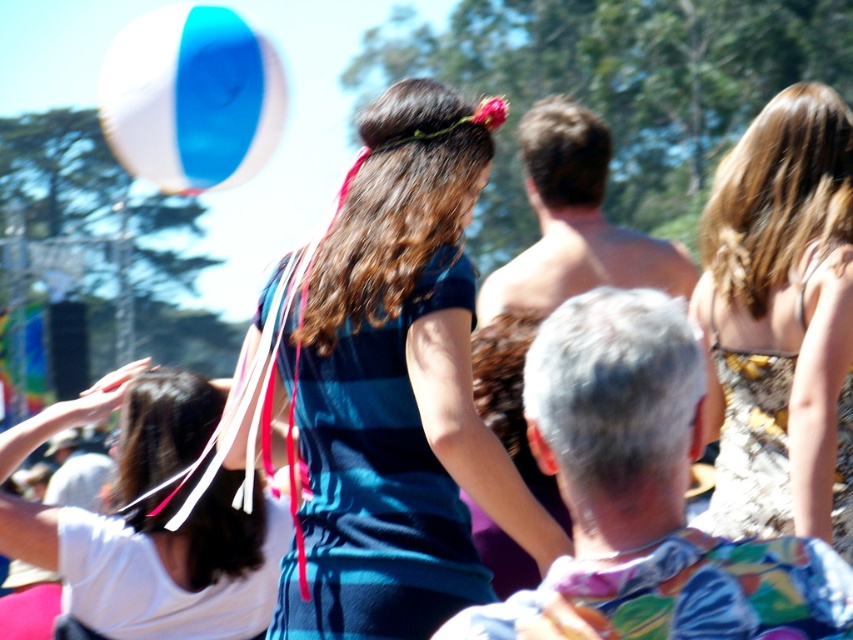
You are standing in the crowd at the festival and want to get a better view of the performance. You notice the brown textured dress at center and the white fabric headband at upper left. Which object is closer to you so you can decide where to move?

The brown textured dress at center is closer to the viewer than the white fabric headband at upper left, so you should move towards the brown textured dress at center to get a better view.